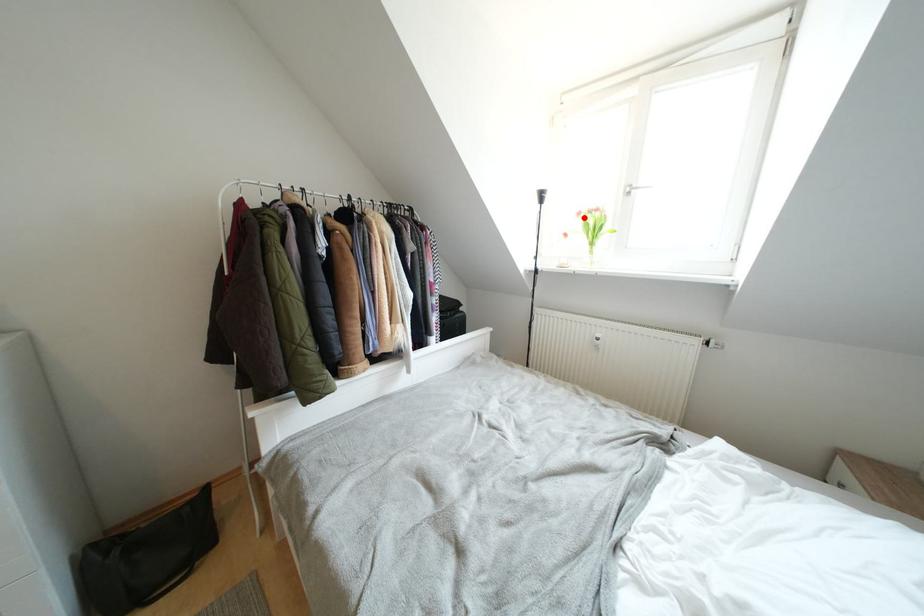
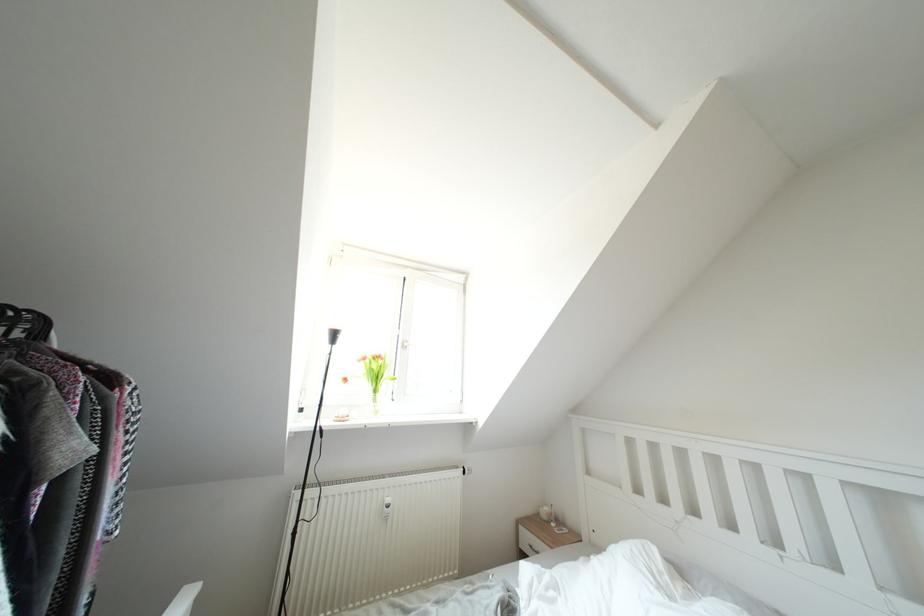
The point at the highlighted location is marked in the first image. Where is the corresponding point in the second image?

(370, 363)